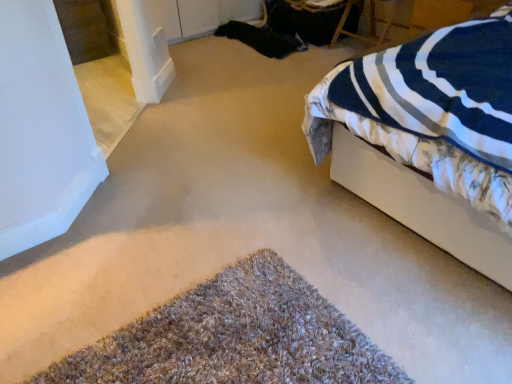
At what (x,y) coordinates should I click in order to perform the action: click on vacant space in between white fabric bed at right and brown shaggy carpet at lower center. Please return your answer as a coordinate pair (x, y). The width and height of the screenshot is (512, 384). Looking at the image, I should click on (297, 272).